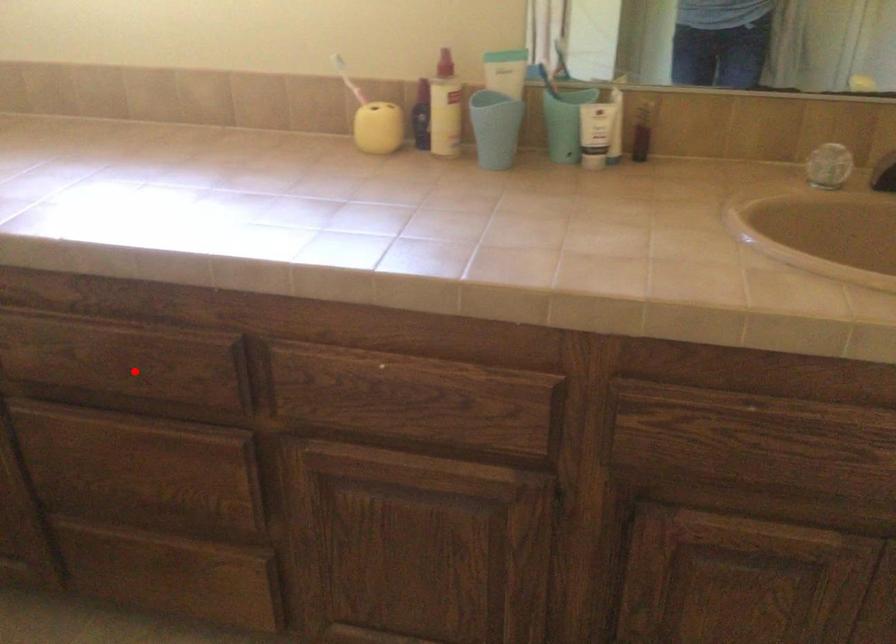
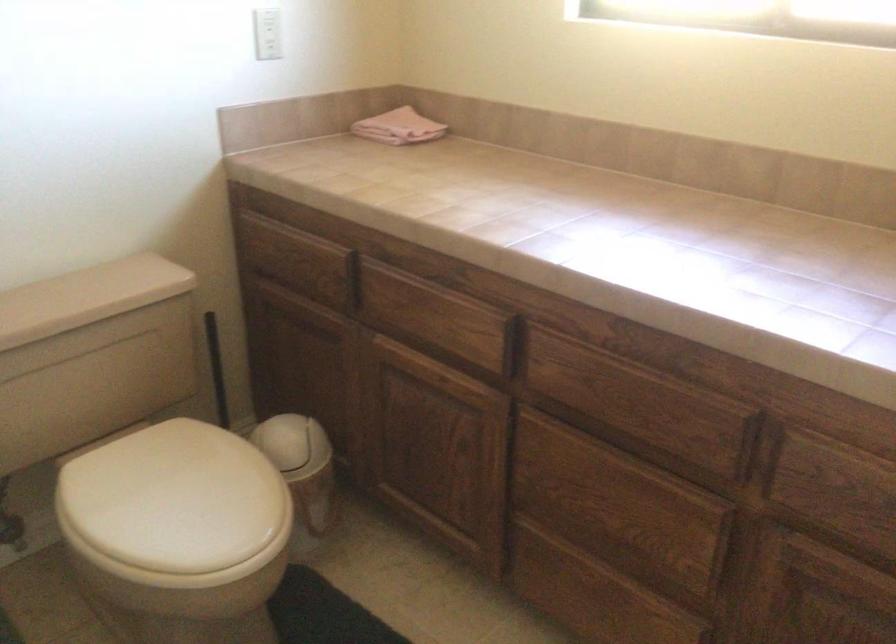
Find the pixel in the second image that matches the highlighted location in the first image.

(643, 408)